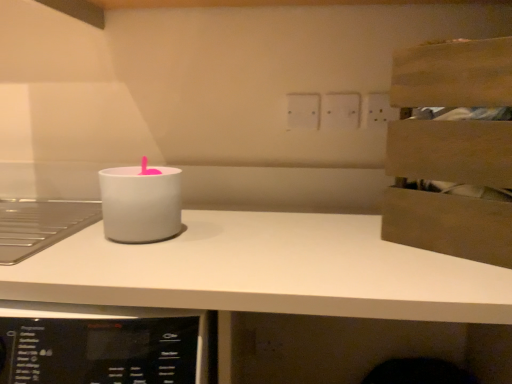
Question: From a real-world perspective, is white matte countertop at center above or below white plastic electric outlet at upper center, which appears as the second electric outlet when viewed from the right?

Choices:
 (A) above
 (B) below

Answer: (B)

Question: Relative to white plastic electric outlet at upper center, which appears as the second electric outlet when viewed from the right, is white matte countertop at center in front or behind?

Choices:
 (A) behind
 (B) front

Answer: (B)

Question: Which object is positioned closest to the white matte candle holder at center?

Choices:
 (A) white plastic electric outlet at upper center, the first electric outlet viewed from the right
 (B) wooden crate at upper right
 (C) white plastic electric outlet at upper center, which appears as the second electric outlet when viewed from the right
 (D) white matte countertop at center

Answer: (D)

Question: Which object is positioned closest to the white plastic electric outlet at upper center, the 2th electric outlet when ordered from left to right?

Choices:
 (A) wooden crate at upper right
 (B) white matte candle holder at center
 (C) white plastic electric outlet at upper center, which appears as the second electric outlet when viewed from the right
 (D) white matte countertop at center

Answer: (C)